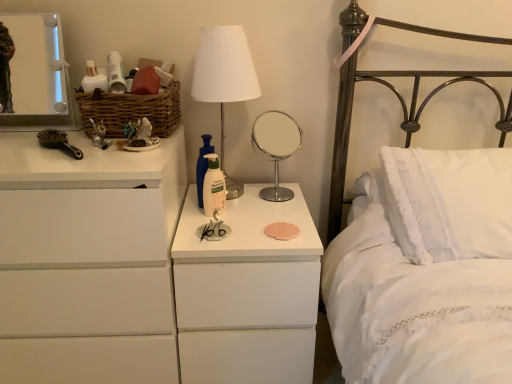
This screenshot has width=512, height=384. Identify the location of free space in front of white fabric lampshade at center. (215, 220).